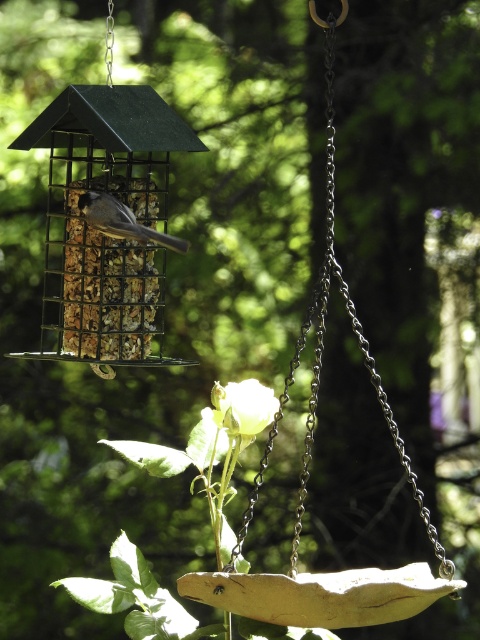
You are a bird trying to reach the yellow rose below the bird feeder. The metallic silver chain at center is in your way. Can you fly around it to the left or right to reach the rose?

The metallic silver chain at center is located at point (319, 292), so you can fly around it either to the left or right to reach the yellow rose below the bird feeder.

You are a photographer aiming to capture a clear photo of the gray matte bird at center without the white matte rose at center blocking it. How should you adjust your camera position?

Move your camera position behind the gray matte bird at center so that it is between the white matte rose at center and the camera. This way, the gray matte bird at center will block the view of the white matte rose at center, allowing for a clear photo of the bird without the rose obstructing it.